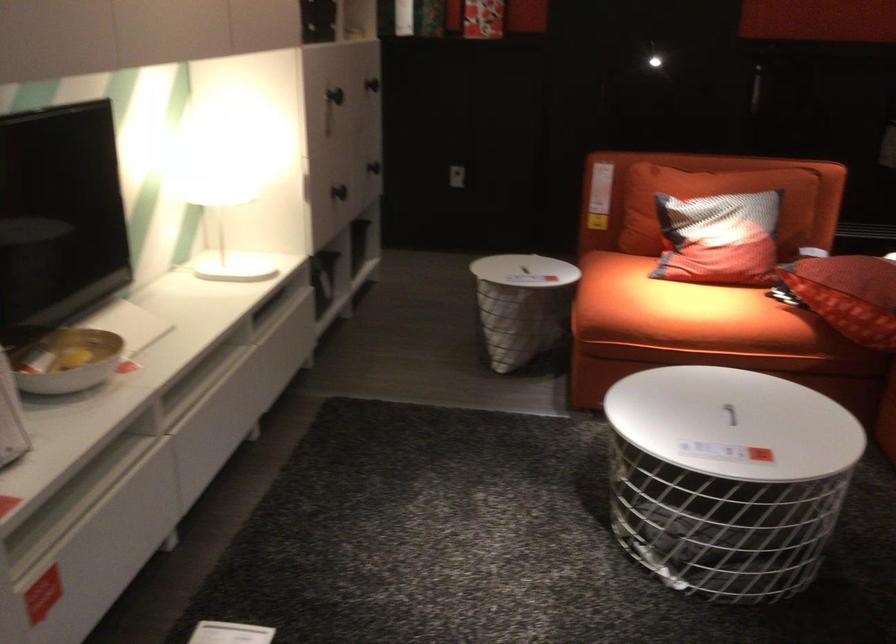
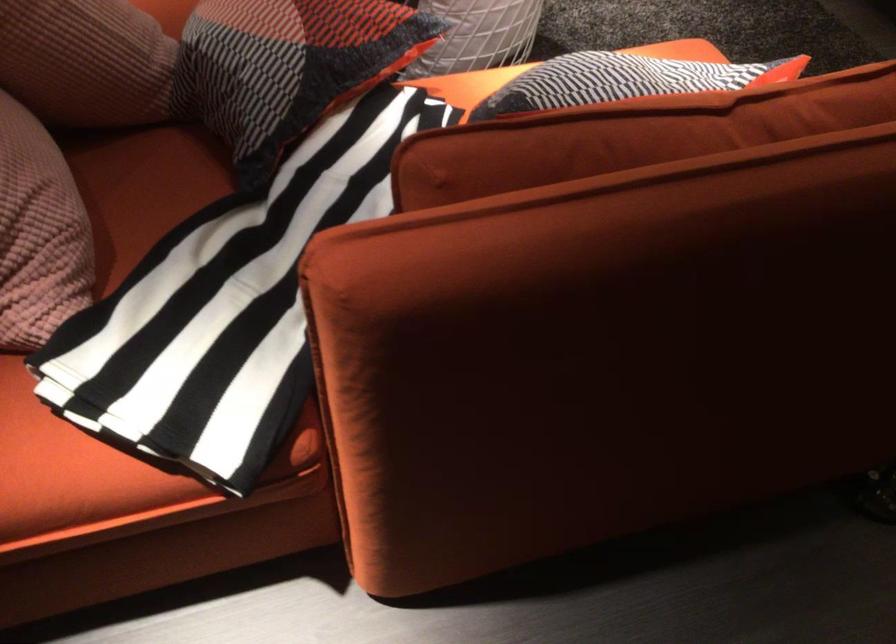
Where in the second image is the point corresponding to the point at 737,185 from the first image?

(623, 80)